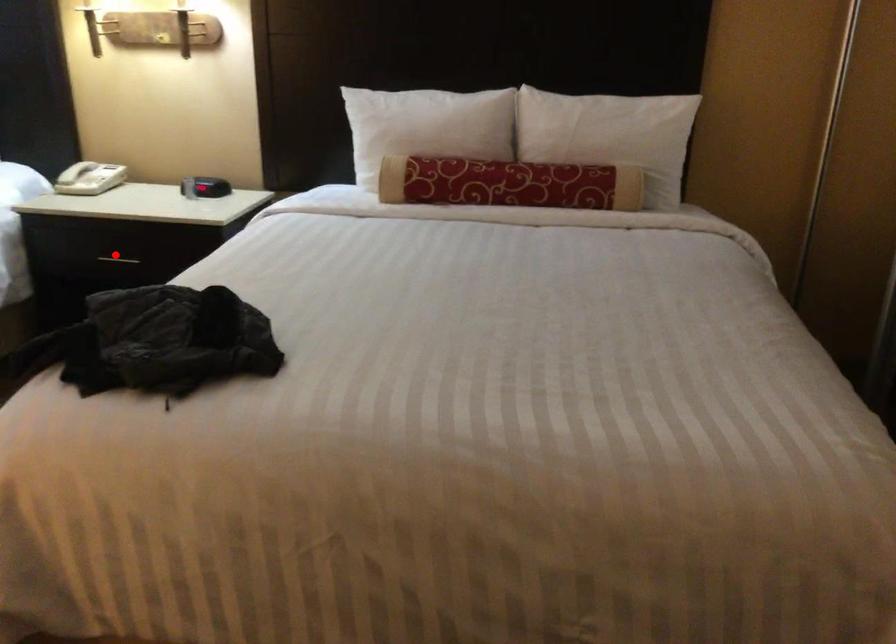
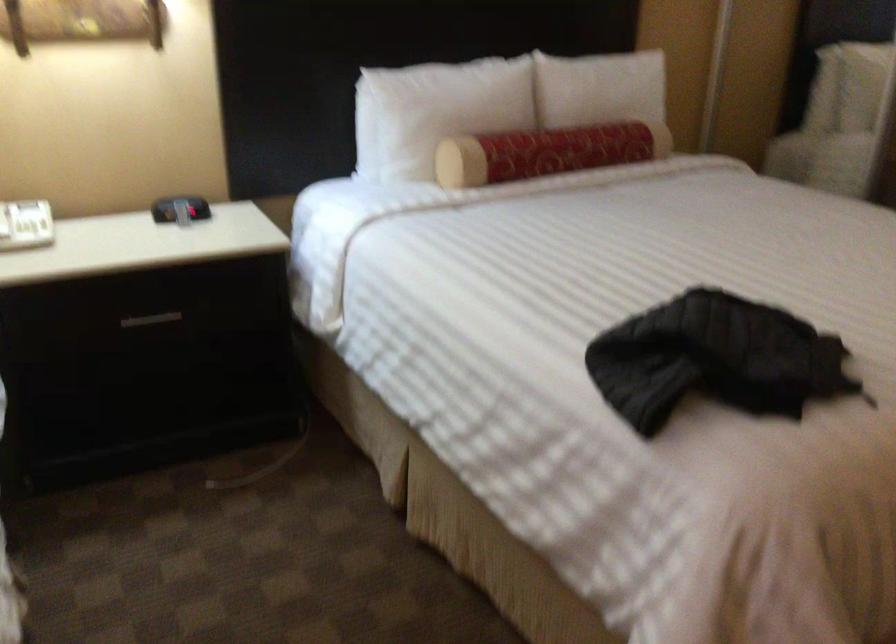
Locate, in the second image, the point that corresponds to the highlighted location in the first image.

(151, 319)